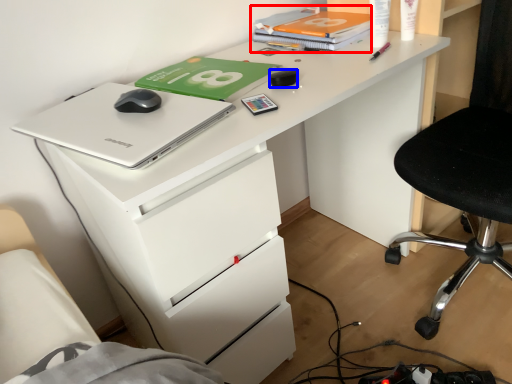
Question: Which object is closer to the camera taking this photo, book (highlighted by a red box) or stationery (highlighted by a blue box)?

Choices:
 (A) book
 (B) stationery

Answer: (B)